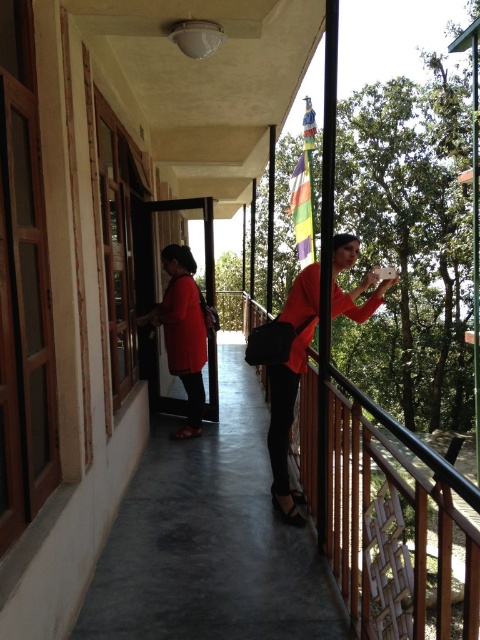
Question: Which of these objects is positioned farthest from the rainbow fabric flag at upper center?

Choices:
 (A) matte red blouse at center
 (B) matte red shirt at left

Answer: (A)

Question: Estimate the real-world distances between objects in this image. Which object is closer to the matte red shirt at left?

Choices:
 (A) matte red blouse at center
 (B) rainbow fabric flag at upper center

Answer: (A)

Question: Which point is closer to the camera taking this photo?

Choices:
 (A) (176, 435)
 (B) (300, 204)
 (C) (271, 394)

Answer: (C)

Question: Can you confirm if matte red blouse at center is smaller than matte red shirt at left?

Choices:
 (A) yes
 (B) no

Answer: (B)

Question: Can you confirm if matte red shirt at left is wider than rainbow fabric flag at upper center?

Choices:
 (A) no
 (B) yes

Answer: (B)

Question: Can you confirm if matte red blouse at center is bigger than matte red shirt at left?

Choices:
 (A) no
 (B) yes

Answer: (B)